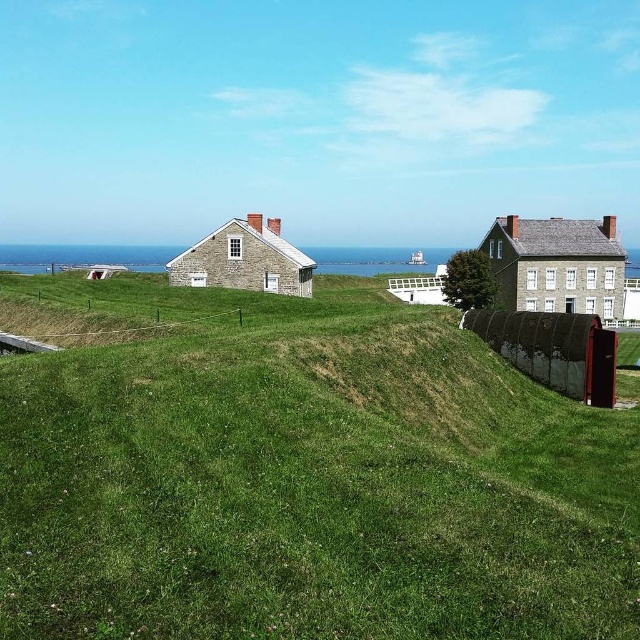
You are standing at the base of the green grassy hill at center and want to reach the stone house at center. Which direction should you walk to get there?

The green grassy hill at center is positioned under the stone house at center, so you should walk upwards towards the crest of the green grassy hill at center to reach the stone house at center.